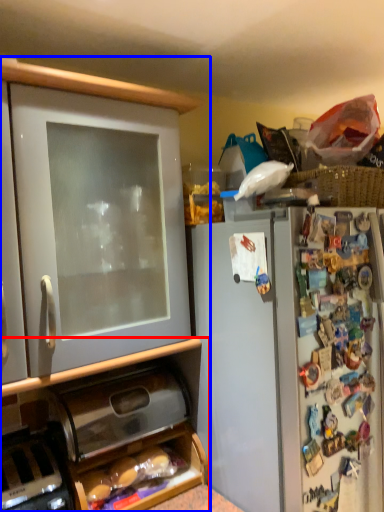
Question: Which object appears closest to the camera in this image, cabinetry (highlighted by a red box) or cabinetry (highlighted by a blue box)?

Choices:
 (A) cabinetry
 (B) cabinetry

Answer: (B)